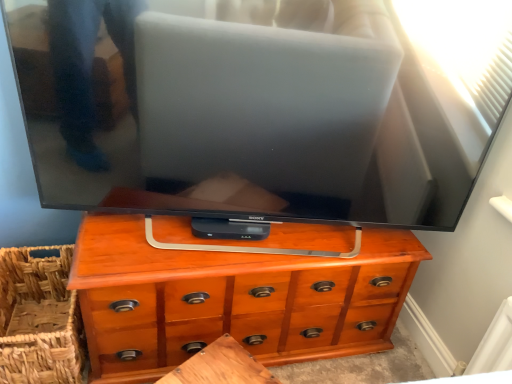
Locate an element on the screen. empty space that is ontop of wooden table at center (from a real-world perspective) is located at coordinates (222, 361).